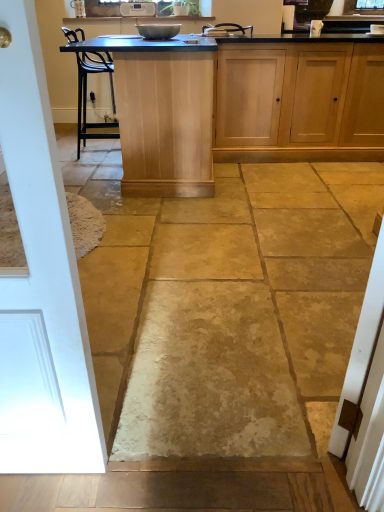
Question: Is light wood cabinet at center bigger than light wood table at center?

Choices:
 (A) no
 (B) yes

Answer: (A)

Question: Would you consider light wood cabinet at center to be distant from light wood table at center?

Choices:
 (A) yes
 (B) no

Answer: (B)

Question: Does light wood cabinet at center have a smaller size compared to light wood table at center?

Choices:
 (A) no
 (B) yes

Answer: (B)

Question: Is light wood cabinet at center wider than light wood table at center?

Choices:
 (A) no
 (B) yes

Answer: (A)

Question: Is light wood cabinet at center to the left of light wood table at center from the viewer's perspective?

Choices:
 (A) no
 (B) yes

Answer: (A)

Question: Is light wood cabinet at center not inside light wood table at center?

Choices:
 (A) no
 (B) yes

Answer: (B)

Question: Is there a large distance between metallic bowl at center and light wood table at center?

Choices:
 (A) yes
 (B) no

Answer: (B)

Question: Does metallic bowl at center have a smaller size compared to light wood table at center?

Choices:
 (A) no
 (B) yes

Answer: (B)

Question: From the image's perspective, is metallic bowl at center under light wood table at center?

Choices:
 (A) no
 (B) yes

Answer: (A)

Question: From the image's perspective, is metallic bowl at center located above light wood table at center?

Choices:
 (A) no
 (B) yes

Answer: (B)

Question: Is metallic bowl at center further to the viewer compared to light wood table at center?

Choices:
 (A) yes
 (B) no

Answer: (A)

Question: Is metallic bowl at center positioned with its back to light wood table at center?

Choices:
 (A) yes
 (B) no

Answer: (B)

Question: Could you tell me if light wood cabinet at center is turned towards metallic bowl at center?

Choices:
 (A) no
 (B) yes

Answer: (A)